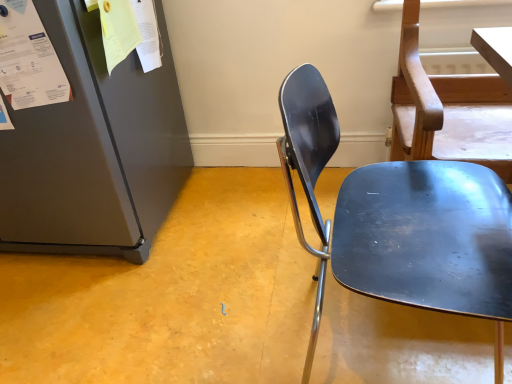
Question: In terms of height, does white paper at upper left look taller or shorter compared to metallic blue chair at center?

Choices:
 (A) short
 (B) tall

Answer: (A)

Question: In the image, is white paper at upper left on the left side or the right side of metallic blue chair at center?

Choices:
 (A) right
 (B) left

Answer: (B)

Question: From the image's perspective, relative to metallic blue chair at center, is white paper at upper left above or below?

Choices:
 (A) above
 (B) below

Answer: (A)

Question: In terms of width, does metallic blue chair at center look wider or thinner when compared to white paper at upper left?

Choices:
 (A) thin
 (B) wide

Answer: (B)

Question: Do you think metallic blue chair at center is within white paper at upper left, or outside of it?

Choices:
 (A) inside
 (B) outside

Answer: (B)

Question: In the image, is metallic blue chair at center on the left side or the right side of white paper at upper left?

Choices:
 (A) left
 (B) right

Answer: (B)

Question: Considering the positions of metallic blue chair at center and white paper at upper left in the image, is metallic blue chair at center bigger or smaller than white paper at upper left?

Choices:
 (A) big
 (B) small

Answer: (A)